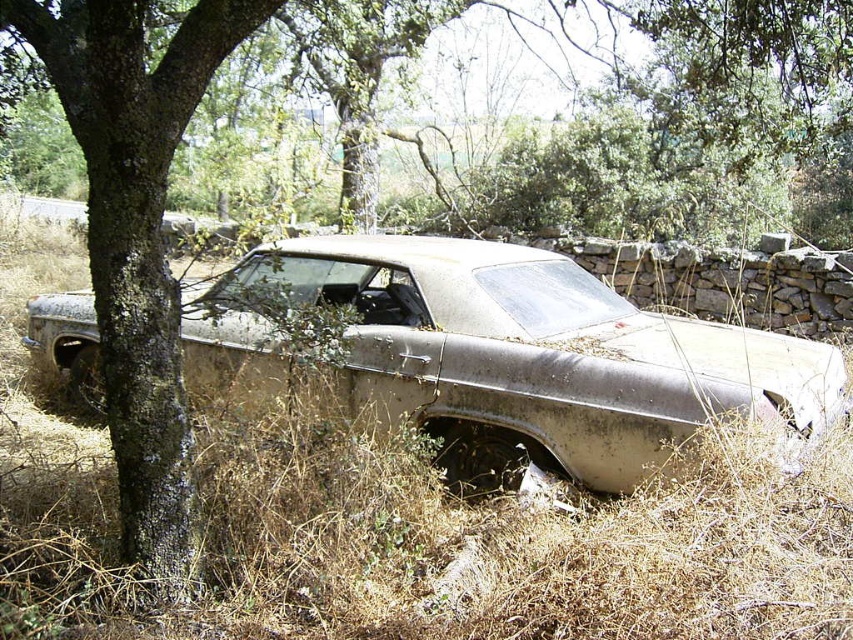
Question: Does rusty metallic car at center have a greater width compared to green rough bark tree at left?

Choices:
 (A) yes
 (B) no

Answer: (A)

Question: Which point is farther to the camera?

Choices:
 (A) green rough bark tree at left
 (B) rusty metallic car at center

Answer: (B)

Question: Is rusty metallic car at center to the right of green rough bark tree at left from the viewer's perspective?

Choices:
 (A) no
 (B) yes

Answer: (B)

Question: Which of the following is the farthest from the observer?

Choices:
 (A) green rough bark tree at left
 (B) rusty metallic car at center

Answer: (B)

Question: Is rusty metallic car at center further to camera compared to green rough bark tree at left?

Choices:
 (A) no
 (B) yes

Answer: (B)